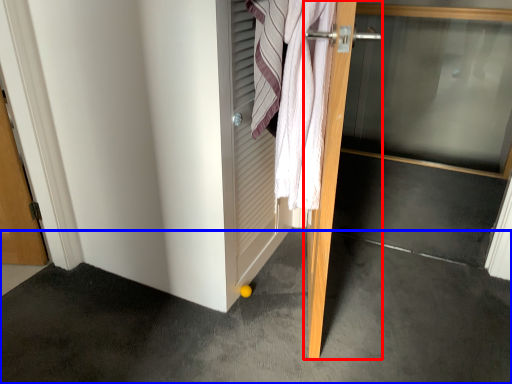
Question: Which object is further to the camera taking this photo, door (highlighted by a red box) or concrete (highlighted by a blue box)?

Choices:
 (A) door
 (B) concrete

Answer: (A)